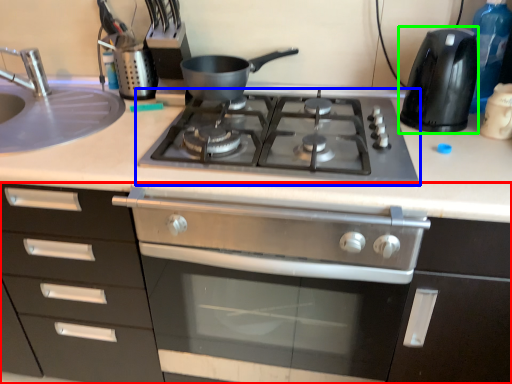
Question: Estimate the real-world distances between objects in this image. Which object is closer to cabinetry (highlighted by a red box), gas stove (highlighted by a blue box) or kitchen appliance (highlighted by a green box)?

Choices:
 (A) gas stove
 (B) kitchen appliance

Answer: (A)